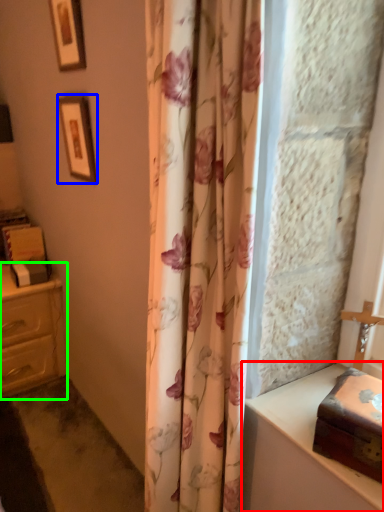
Question: Which is nearer to the vanity (highlighted by a red box)? picture frame (highlighted by a blue box) or chest of drawers (highlighted by a green box).

Choices:
 (A) picture frame
 (B) chest of drawers

Answer: (A)